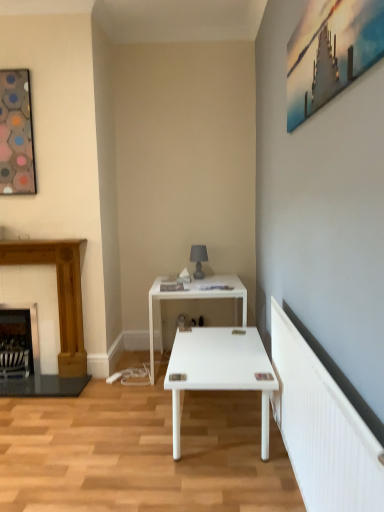
Question: In the image, is metallic silver painting at upper right, the second picture frame from the back, on the left side or the right side of wooden fireplace at left, acting as the first fireplace starting from the right?

Choices:
 (A) right
 (B) left

Answer: (A)

Question: From the image's perspective, is metallic silver painting at upper right, marked as the 2th picture frame in a left-to-right arrangement, located above or below wooden fireplace at left, arranged as the 2th fireplace when viewed from the left?

Choices:
 (A) above
 (B) below

Answer: (A)

Question: Based on their relative distances, which object is nearer to the dark wood fireplace at left, acting as the 1th fireplace starting from the left?

Choices:
 (A) wooden fireplace at left, arranged as the 2th fireplace when viewed from the left
 (B) matte gray table lamp at center
 (C) hexagonal mosaic frame at upper left, the 1th picture frame in the left-to-right sequence
 (D) white glossy table at center
 (E) metallic silver painting at upper right, marked as the first picture frame in a front-to-back arrangement

Answer: (A)

Question: Estimate the real-world distances between objects in this image. Which object is farther from the wooden fireplace at left, arranged as the 2th fireplace when viewed from the left?

Choices:
 (A) matte gray table lamp at center
 (B) dark wood fireplace at left, which is the second fireplace from right to left
 (C) metallic silver painting at upper right, marked as the 2th picture frame in a left-to-right arrangement
 (D) hexagonal mosaic frame at upper left, which is the second picture frame in front-to-back order
 (E) white glossy table at center

Answer: (C)